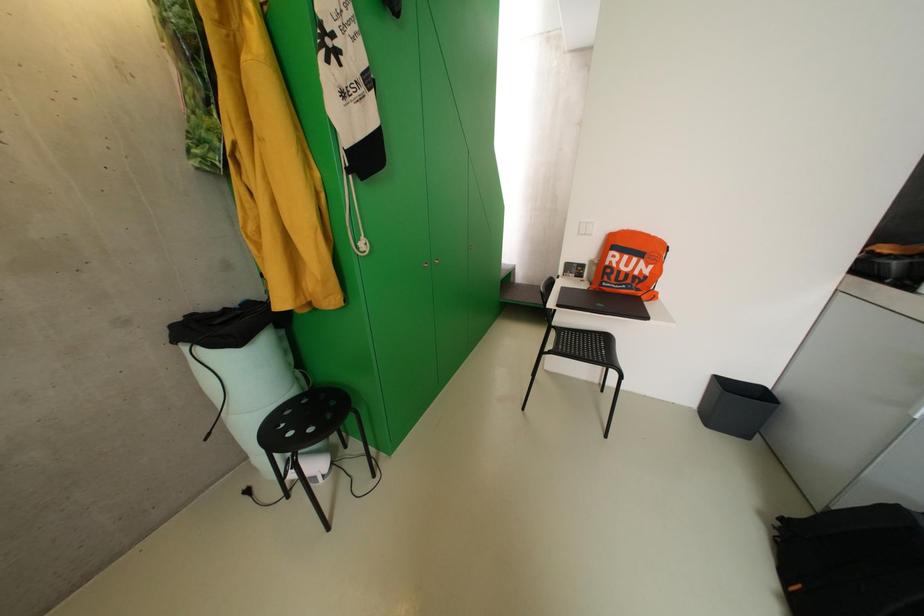
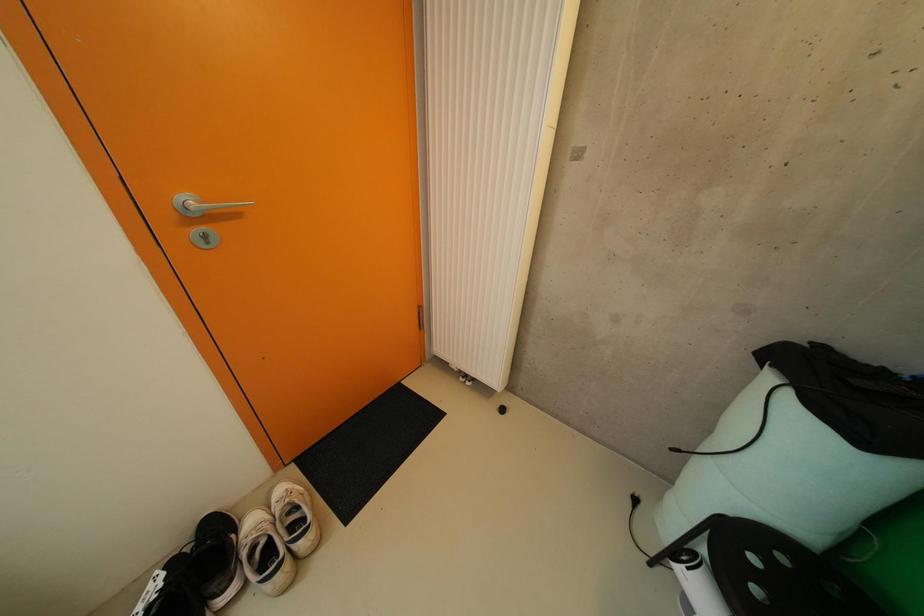
From the picture: The images are taken continuously from a first-person perspective. In which direction is your viewpoint rotating?

The camera's rotation is toward left-down.